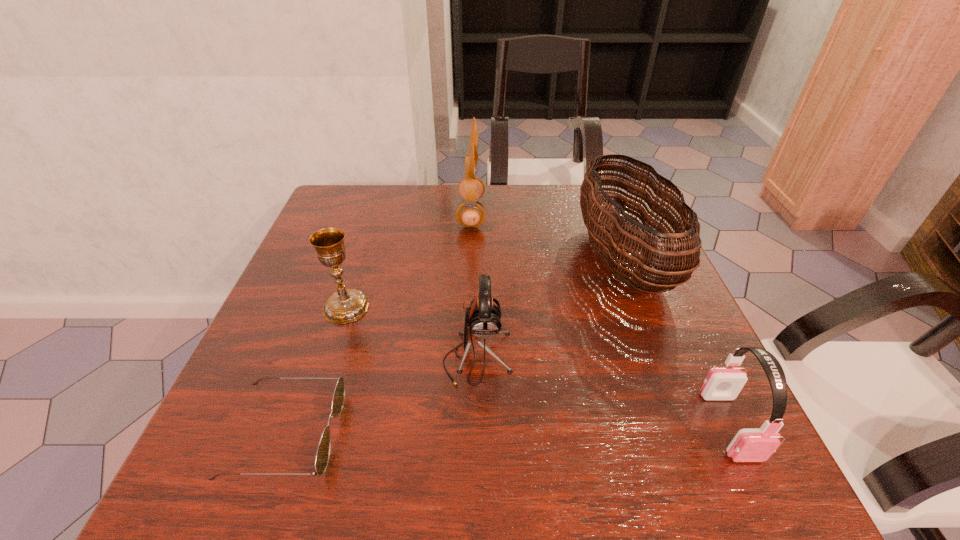
You are a GUI agent. You are given a task and a screenshot of the screen. Output one action in this format:
    pyautogui.click(x=<x>, y=<y>)
    Task: Click on the free point between the tallest object and the basket
    Image resolution: width=960 pixels, height=540 pixels.
    Given the screenshot: What is the action you would take?
    pyautogui.click(x=547, y=237)

Identify the location of free space between the tallest object and the chalice. (409, 260).

Find the location of a particular element. This screenshot has width=960, height=540. vacant area that lies between the farthest earphone and the chalice is located at coordinates (409, 260).

You are a GUI agent. You are given a task and a screenshot of the screen. Output one action in this format:
    pyautogui.click(x=<x>, y=<y>)
    Task: Click on the free spot between the nearest earphone and the tallest object
    
    Given the screenshot: What is the action you would take?
    pyautogui.click(x=600, y=319)

This screenshot has height=540, width=960. What are the coordinates of `vacant region between the sunglasses and the nearest earphone` in the screenshot? It's located at (508, 429).

The image size is (960, 540). I want to click on free space between the fourth farthest object and the tallest earphone, so click(474, 286).

Image resolution: width=960 pixels, height=540 pixels. What are the coordinates of `empty space that is in between the tallest object and the rightmost earphone` in the screenshot? It's located at (600, 319).

In order to click on vacant space that is in between the rightmost earphone and the tallest earphone in this screenshot , I will do `click(600, 319)`.

At what (x,y) coordinates should I click in order to perform the action: click on vacant point located between the second farthest earphone and the rightmost earphone. Please return your answer as a coordinate pair (x, y). Looking at the image, I should click on (604, 392).

The height and width of the screenshot is (540, 960). I want to click on free space between the rightmost earphone and the sunglasses, so click(508, 429).